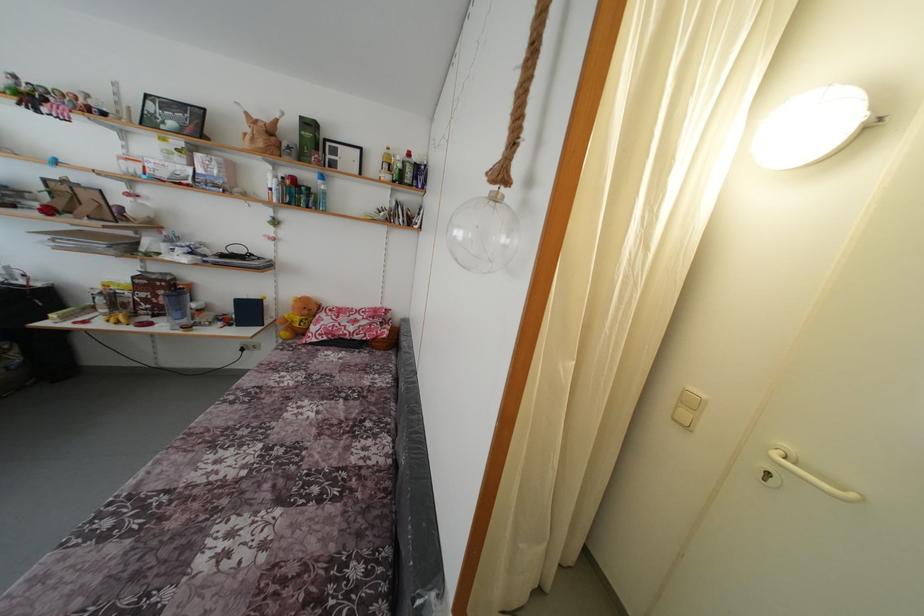
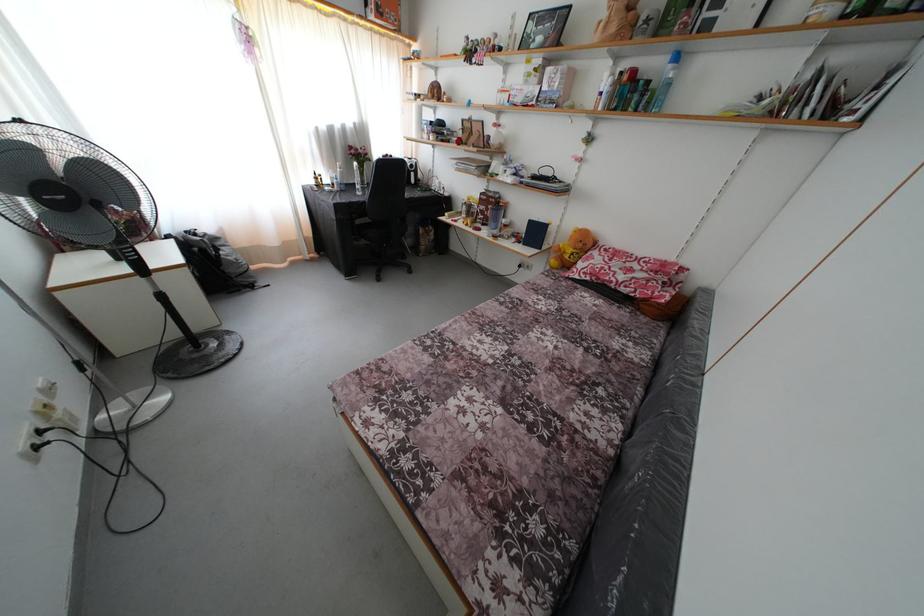
Find the pixel in the second image that matches point 160,322 in the first image.

(488, 230)